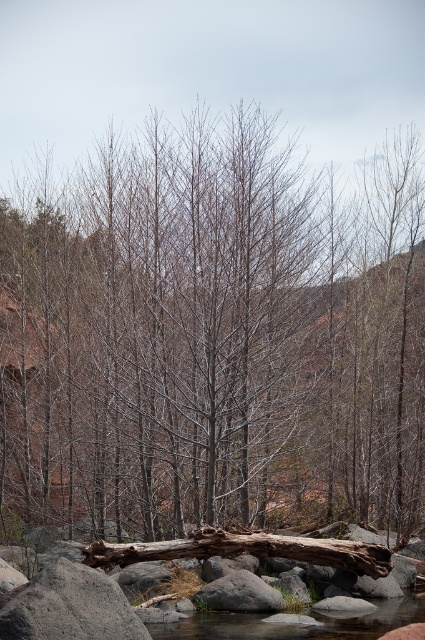
Question: Which point is farther to the camera?

Choices:
 (A) (224, 592)
 (B) (82, 301)

Answer: (B)

Question: Which point is closer to the camera?

Choices:
 (A) (240, 614)
 (B) (243, 579)

Answer: (A)

Question: Does brown rough wood log at center appear on the right side of clear water at lower center?

Choices:
 (A) no
 (B) yes

Answer: (B)

Question: Can you confirm if brown rough wood log at center is positioned to the right of clear water at lower center?

Choices:
 (A) yes
 (B) no

Answer: (A)

Question: Which point is closer to the camera?

Choices:
 (A) (235, 369)
 (B) (50, 604)
 (C) (255, 576)

Answer: (B)

Question: Is bare branches at center closer to the viewer compared to gray rock at center?

Choices:
 (A) no
 (B) yes

Answer: (A)